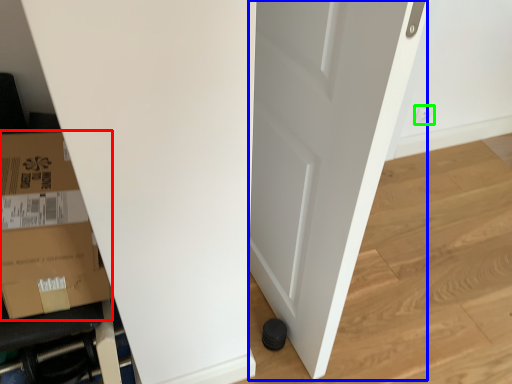
Question: Estimate the real-world distances between objects in this image. Which object is closer to cardboard box (highlighted by a red box), door (highlighted by a blue box) or electric outlet (highlighted by a green box)?

Choices:
 (A) door
 (B) electric outlet

Answer: (A)